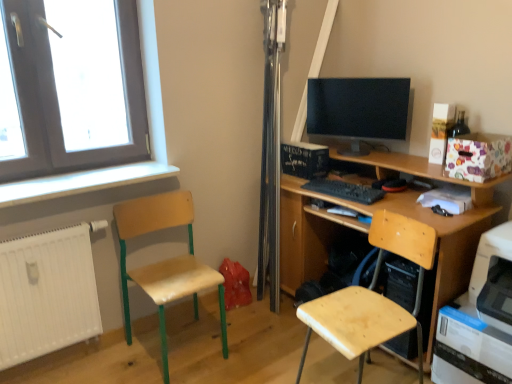
You are a GUI agent. You are given a task and a screenshot of the screen. Output one action in this format:
    pyautogui.click(x=<x>, y=<y>)
    Task: Click on the vacant space in wooden seat at left, the 1th chair positioned from the left (from a real-world perspective)
    Image resolution: width=512 pixels, height=384 pixels.
    Given the screenshot: What is the action you would take?
    pyautogui.click(x=181, y=346)